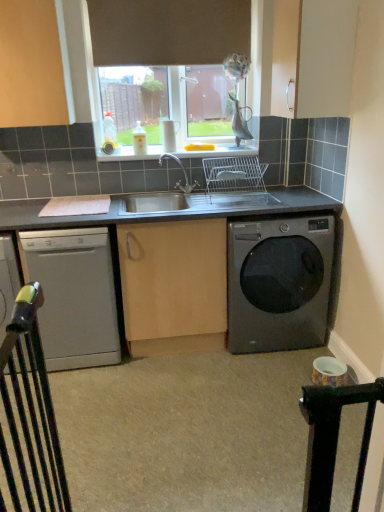
Question: Is metallic gray washing machine at lower right further to the viewer compared to stainless steel sink at center?

Choices:
 (A) no
 (B) yes

Answer: (B)

Question: Does metallic gray washing machine at lower right have a smaller size compared to stainless steel sink at center?

Choices:
 (A) yes
 (B) no

Answer: (B)

Question: Is metallic gray washing machine at lower right oriented away from stainless steel sink at center?

Choices:
 (A) yes
 (B) no

Answer: (B)

Question: From the image's perspective, is metallic gray washing machine at lower right under stainless steel sink at center?

Choices:
 (A) no
 (B) yes

Answer: (B)

Question: Is metallic gray washing machine at lower right outside of stainless steel sink at center?

Choices:
 (A) no
 (B) yes

Answer: (B)

Question: Is stainless steel sink at center to the left or to the right of satin silver dishwasher at lower left in the image?

Choices:
 (A) right
 (B) left

Answer: (A)

Question: Is stainless steel sink at center in front of or behind satin silver dishwasher at lower left in the image?

Choices:
 (A) behind
 (B) front

Answer: (A)

Question: Is stainless steel sink at center inside the boundaries of satin silver dishwasher at lower left, or outside?

Choices:
 (A) outside
 (B) inside

Answer: (A)

Question: Is point (220, 163) closer or farther from the camera than point (41, 230)?

Choices:
 (A) closer
 (B) farther

Answer: (B)

Question: In terms of size, does black metal gate at lower left appear bigger or smaller than stainless steel sink at center?

Choices:
 (A) big
 (B) small

Answer: (B)

Question: From the image's perspective, is black metal gate at lower left located above or below stainless steel sink at center?

Choices:
 (A) above
 (B) below

Answer: (B)

Question: Does point (26, 482) appear closer or farther from the camera than point (221, 158)?

Choices:
 (A) closer
 (B) farther

Answer: (A)

Question: From their relative heights in the image, would you say black metal gate at lower left is taller or shorter than stainless steel sink at center?

Choices:
 (A) short
 (B) tall

Answer: (B)

Question: From their relative heights in the image, would you say metallic gray washing machine at lower right is taller or shorter than satin silver dishwasher at lower left?

Choices:
 (A) short
 (B) tall

Answer: (A)

Question: Based on their positions, is metallic gray washing machine at lower right located to the left or right of satin silver dishwasher at lower left?

Choices:
 (A) left
 (B) right

Answer: (B)